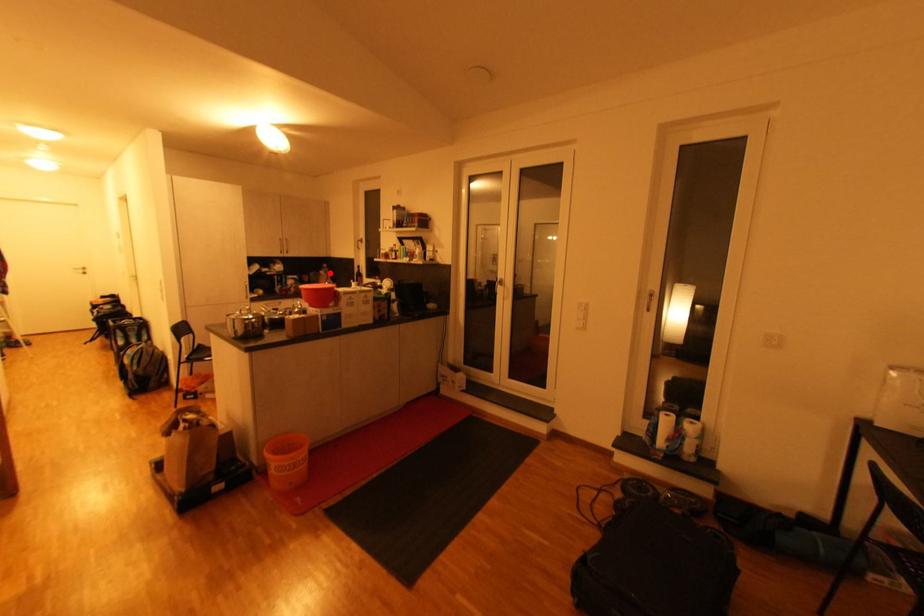
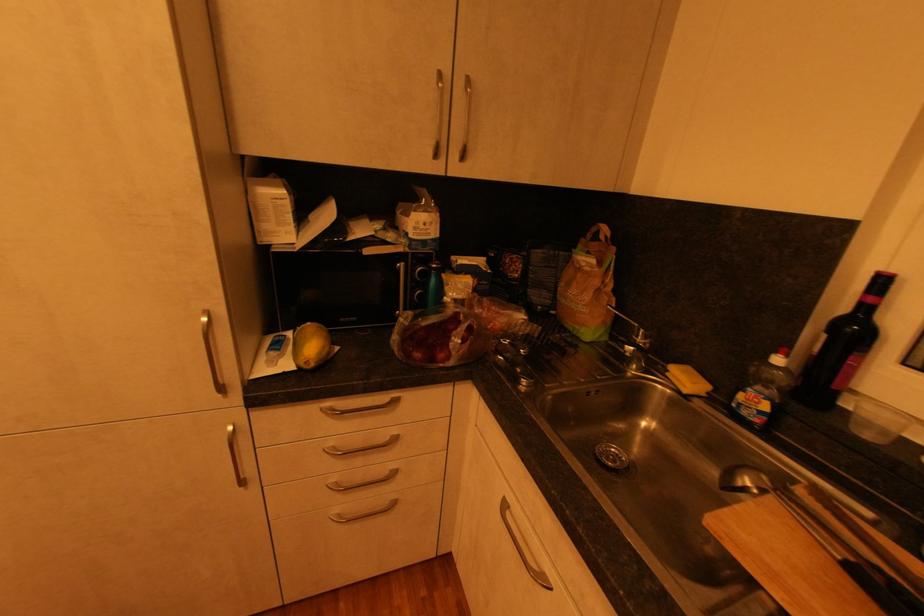
Locate, in the second image, the point that corresponds to the highlighted location in the first image.

(604, 264)